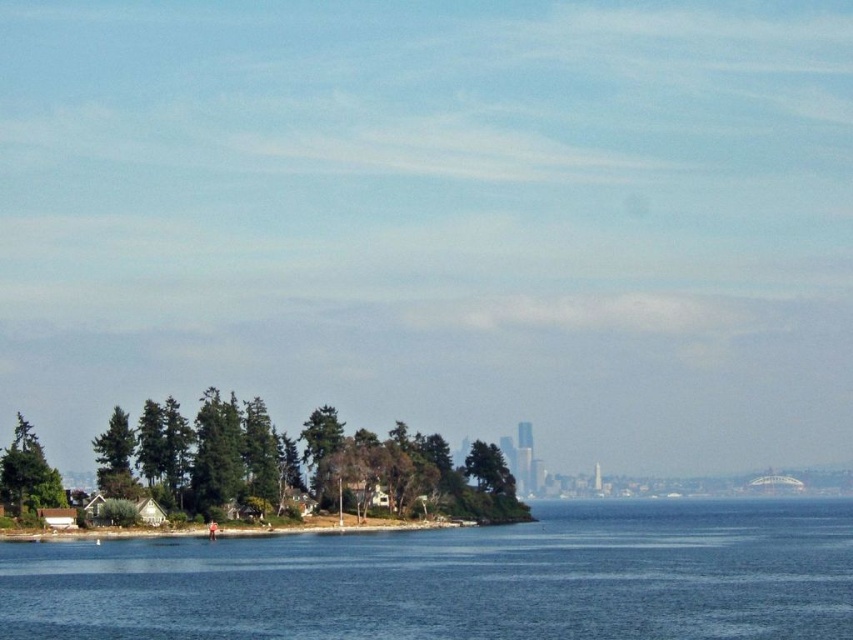
Question: Which point appears farthest from the camera in this image?

Choices:
 (A) (15, 460)
 (B) (506, 612)

Answer: (A)

Question: Is blue water at lower center smaller than green matte tree at lower left?

Choices:
 (A) yes
 (B) no

Answer: (B)

Question: Considering the real-world distances, which object is farthest from the blue water at lower center?

Choices:
 (A) green matte tree at left
 (B) green matte tree at lower left

Answer: (A)

Question: Which of the following is the farthest from the observer?

Choices:
 (A) (346, 544)
 (B) (4, 468)

Answer: (B)

Question: Does blue water at lower center lie in front of green matte tree at lower left?

Choices:
 (A) no
 (B) yes

Answer: (B)

Question: Does blue water at lower center appear on the left side of green matte tree at lower left?

Choices:
 (A) yes
 (B) no

Answer: (B)